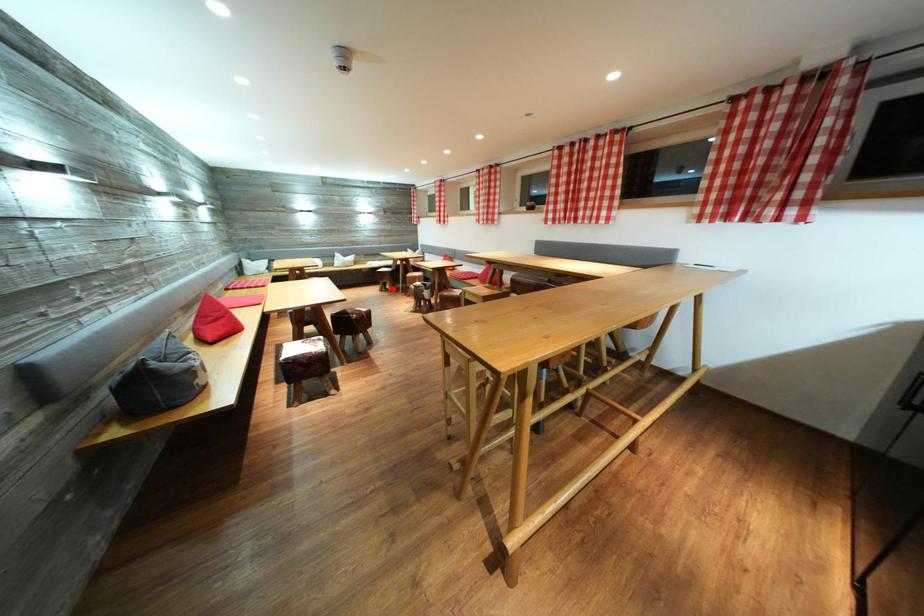
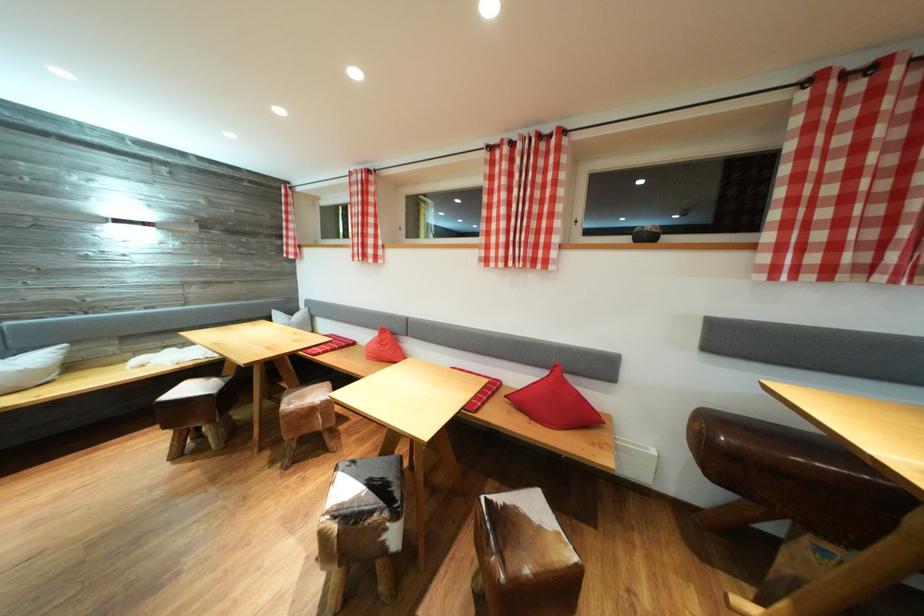
Where in the second image is the point corresponding to the highlighted location from the first image?

(203, 434)